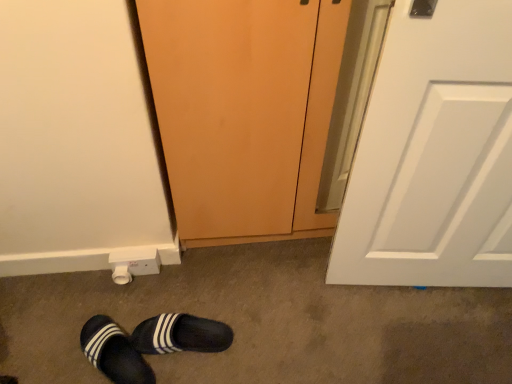
In order to face black suede slippers at lower left, the 1th footwear positioned from the right, should I rotate leftwards or rightwards?

To align with it, rotate left about 10.194°.

Find the location of `matte wood screen door at center`. matte wood screen door at center is located at coordinates (244, 112).

Describe the element at coordinates (114, 352) in the screenshot. I see `black fabric slippers at lower left, marked as the 2th footwear in a right-to-left arrangement` at that location.

Measure the distance between white plastic electric outlet at lower left and camera.

A distance of 4.51 feet exists between white plastic electric outlet at lower left and camera.

The height and width of the screenshot is (384, 512). Identify the location of black suede slippers at lower left, which is the second footwear in left-to-right order. (181, 335).

Does matte wood screen door at center turn towards black suede slippers at lower left, which is the second footwear in left-to-right order?

Yes, matte wood screen door at center is aimed at black suede slippers at lower left, which is the second footwear in left-to-right order.

From a real-world perspective, does matte wood screen door at center stand above black suede slippers at lower left, the 1th footwear positioned from the right?

Correct, in the physical world, matte wood screen door at center is higher than black suede slippers at lower left, the 1th footwear positioned from the right.

Which object is positioned more to the left, matte wood screen door at center or black suede slippers at lower left, which is the second footwear in left-to-right order?

Positioned to the left is black suede slippers at lower left, which is the second footwear in left-to-right order.

What's the angular difference between matte wood screen door at center and black suede slippers at lower left, which is the second footwear in left-to-right order,'s facing directions?

They differ by 81.3 degrees in their facing directions.

Is black fabric slippers at lower left, marked as the 2th footwear in a right-to-left arrangement, inside the boundaries of black suede slippers at lower left, which is the second footwear in left-to-right order, or outside?

black fabric slippers at lower left, marked as the 2th footwear in a right-to-left arrangement, cannot be found inside black suede slippers at lower left, which is the second footwear in left-to-right order.

At what (x,y) coordinates should I click in order to perform the action: click on footwear on the right of black fabric slippers at lower left, marked as the 2th footwear in a right-to-left arrangement. Please return your answer as a coordinate pair (x, y). Image resolution: width=512 pixels, height=384 pixels. Looking at the image, I should click on (181, 335).

From the picture: From a real-world perspective, is black fabric slippers at lower left, marked as the 2th footwear in a right-to-left arrangement, on top of black suede slippers at lower left, the 1th footwear positioned from the right?

No, from a real-world perspective, black fabric slippers at lower left, marked as the 2th footwear in a right-to-left arrangement, is not over black suede slippers at lower left, the 1th footwear positioned from the right

Who is shorter, black fabric slippers at lower left, marked as the 2th footwear in a right-to-left arrangement, or black suede slippers at lower left, which is the second footwear in left-to-right order?

Standing shorter between the two is black suede slippers at lower left, which is the second footwear in left-to-right order.

Relative to matte wood screen door at center, is black fabric slippers at lower left, arranged as the 1th footwear when viewed from the left, in front or behind?

Visually, black fabric slippers at lower left, arranged as the 1th footwear when viewed from the left, is located behind matte wood screen door at center.

What's the angular difference between black fabric slippers at lower left, arranged as the 1th footwear when viewed from the left, and matte wood screen door at center's facing directions?

There is a 38.4-degree angle between the facing directions of black fabric slippers at lower left, arranged as the 1th footwear when viewed from the left, and matte wood screen door at center.

Looking at this image, between black fabric slippers at lower left, arranged as the 1th footwear when viewed from the left, and matte wood screen door at center, which one has smaller width?

Thinner between the two is black fabric slippers at lower left, arranged as the 1th footwear when viewed from the left.

From a real-world perspective, is black suede slippers at lower left, the 1th footwear positioned from the right, above or below black fabric slippers at lower left, marked as the 2th footwear in a right-to-left arrangement?

From a real-world perspective, black suede slippers at lower left, the 1th footwear positioned from the right, is physically above black fabric slippers at lower left, marked as the 2th footwear in a right-to-left arrangement.

Is black suede slippers at lower left, the 1th footwear positioned from the right, inside or outside of black fabric slippers at lower left, marked as the 2th footwear in a right-to-left arrangement?

black suede slippers at lower left, the 1th footwear positioned from the right, is outside black fabric slippers at lower left, marked as the 2th footwear in a right-to-left arrangement.

Is the surface of black suede slippers at lower left, the 1th footwear positioned from the right, in direct contact with black fabric slippers at lower left, arranged as the 1th footwear when viewed from the left?

Yes, the surface of black suede slippers at lower left, the 1th footwear positioned from the right, is in contact with black fabric slippers at lower left, arranged as the 1th footwear when viewed from the left.

The height and width of the screenshot is (384, 512). I want to click on electric outlet above the black fabric slippers at lower left, arranged as the 1th footwear when viewed from the left (from a real-world perspective), so click(x=133, y=263).

From their relative heights in the image, would you say black fabric slippers at lower left, marked as the 2th footwear in a right-to-left arrangement, is taller or shorter than white plastic electric outlet at lower left?

In the image, black fabric slippers at lower left, marked as the 2th footwear in a right-to-left arrangement, appears to be shorter than white plastic electric outlet at lower left.

In the scene shown: Is white plastic electric outlet at lower left a part of black fabric slippers at lower left, arranged as the 1th footwear when viewed from the left?

Actually, white plastic electric outlet at lower left is outside black fabric slippers at lower left, arranged as the 1th footwear when viewed from the left.

Is black fabric slippers at lower left, arranged as the 1th footwear when viewed from the left, in front of white plastic electric outlet at lower left?

Yes, black fabric slippers at lower left, arranged as the 1th footwear when viewed from the left, is closer to the camera.

Based on the photo, considering the positions of objects white plastic electric outlet at lower left and black fabric slippers at lower left, arranged as the 1th footwear when viewed from the left, in the image provided, who is more to the left, white plastic electric outlet at lower left or black fabric slippers at lower left, arranged as the 1th footwear when viewed from the left,?

From the viewer's perspective, black fabric slippers at lower left, arranged as the 1th footwear when viewed from the left, appears more on the left side.

Which of these two, white plastic electric outlet at lower left or black fabric slippers at lower left, arranged as the 1th footwear when viewed from the left, is smaller?

white plastic electric outlet at lower left is smaller.

From a real-world perspective, who is located lower, white plastic electric outlet at lower left or black fabric slippers at lower left, marked as the 2th footwear in a right-to-left arrangement?

In real-world perspective, black fabric slippers at lower left, marked as the 2th footwear in a right-to-left arrangement, is lower.

Is white plastic electric outlet at lower left turned away from black fabric slippers at lower left, arranged as the 1th footwear when viewed from the left?

No, white plastic electric outlet at lower left is not facing the opposite direction of black fabric slippers at lower left, arranged as the 1th footwear when viewed from the left.

Considering the sizes of objects matte wood screen door at center and white plastic electric outlet at lower left in the image provided, who is smaller, matte wood screen door at center or white plastic electric outlet at lower left?

Smaller between the two is white plastic electric outlet at lower left.

Is point (311, 67) farther from camera compared to point (158, 272)?

No, it is not.

Based on the photo, is matte wood screen door at center wider or thinner than white plastic electric outlet at lower left?

Considering their sizes, matte wood screen door at center looks broader than white plastic electric outlet at lower left.

Is matte wood screen door at center directly adjacent to white plastic electric outlet at lower left?

No, matte wood screen door at center is not with white plastic electric outlet at lower left.

At what (x,y) coordinates should I click in order to perform the action: click on the 1st footwear below when counting from the matte wood screen door at center (from the image's perspective). Please return your answer as a coordinate pair (x, y). This screenshot has height=384, width=512. Looking at the image, I should click on (181, 335).

Image resolution: width=512 pixels, height=384 pixels. Find the location of `footwear on the right of the black fabric slippers at lower left, arranged as the 1th footwear when viewed from the left`. footwear on the right of the black fabric slippers at lower left, arranged as the 1th footwear when viewed from the left is located at coordinates (181, 335).

Based on their spatial positions, is black fabric slippers at lower left, arranged as the 1th footwear when viewed from the left, or white plastic electric outlet at lower left further from matte wood screen door at center?

The object further to matte wood screen door at center is black fabric slippers at lower left, arranged as the 1th footwear when viewed from the left.

Looking at the image, which one is located further to matte wood screen door at center, black suede slippers at lower left, the 1th footwear positioned from the right, or white plastic electric outlet at lower left?

Based on the image, black suede slippers at lower left, the 1th footwear positioned from the right, appears to be further to matte wood screen door at center.

Looking at this image, based on their spatial positions, is matte wood screen door at center or black suede slippers at lower left, which is the second footwear in left-to-right order, closer to black fabric slippers at lower left, marked as the 2th footwear in a right-to-left arrangement?

The object closer to black fabric slippers at lower left, marked as the 2th footwear in a right-to-left arrangement, is black suede slippers at lower left, which is the second footwear in left-to-right order.

Looking at the image, which one is located further to black suede slippers at lower left, the 1th footwear positioned from the right, black fabric slippers at lower left, arranged as the 1th footwear when viewed from the left, or matte wood screen door at center?

matte wood screen door at center is further to black suede slippers at lower left, the 1th footwear positioned from the right.

Considering their positions, is black fabric slippers at lower left, arranged as the 1th footwear when viewed from the left, positioned closer to white plastic electric outlet at lower left than matte wood screen door at center?

Based on the image, black fabric slippers at lower left, arranged as the 1th footwear when viewed from the left, appears to be nearer to white plastic electric outlet at lower left.

Which object lies further to the anchor point white plastic electric outlet at lower left, matte wood screen door at center or black fabric slippers at lower left, arranged as the 1th footwear when viewed from the left?

Based on the image, matte wood screen door at center appears to be further to white plastic electric outlet at lower left.

Considering their positions, is matte wood screen door at center positioned further to black suede slippers at lower left, which is the second footwear in left-to-right order, than black fabric slippers at lower left, marked as the 2th footwear in a right-to-left arrangement?

Based on the image, matte wood screen door at center appears to be further to black suede slippers at lower left, which is the second footwear in left-to-right order.

Which object lies nearer to the anchor point black suede slippers at lower left, the 1th footwear positioned from the right, white plastic electric outlet at lower left or matte wood screen door at center?

Based on the image, white plastic electric outlet at lower left appears to be nearer to black suede slippers at lower left, the 1th footwear positioned from the right.

At what (x,y) coordinates should I click in order to perform the action: click on footwear between matte wood screen door at center and black fabric slippers at lower left, marked as the 2th footwear in a right-to-left arrangement, in the up-down direction. Please return your answer as a coordinate pair (x, y). This screenshot has width=512, height=384. Looking at the image, I should click on (181, 335).

You are a GUI agent. You are given a task and a screenshot of the screen. Output one action in this format:
    pyautogui.click(x=<x>, y=<y>)
    Task: Click on the electric outlet between matte wood screen door at center and black fabric slippers at lower left, arranged as the 1th footwear when viewed from the left, in the up-down direction
    
    Given the screenshot: What is the action you would take?
    pyautogui.click(x=133, y=263)

The height and width of the screenshot is (384, 512). Identify the location of footwear located between black fabric slippers at lower left, arranged as the 1th footwear when viewed from the left, and white plastic electric outlet at lower left in the depth direction. (181, 335).

Locate an element on the screen. electric outlet between matte wood screen door at center and black suede slippers at lower left, which is the second footwear in left-to-right order, in the up-down direction is located at coordinates coord(133,263).